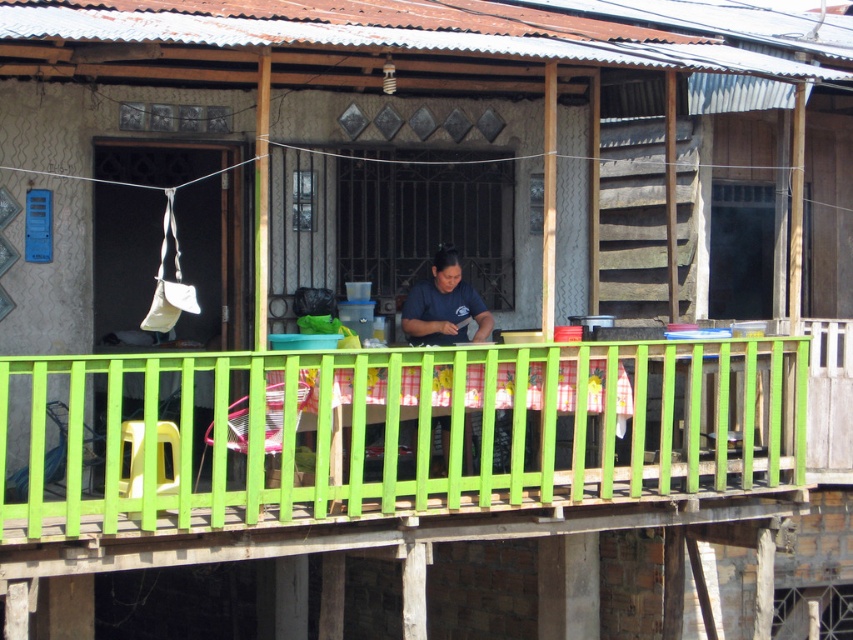
Question: Which point is farther to the camera?

Choices:
 (A) (370, 417)
 (B) (447, 461)

Answer: (B)

Question: Which point is farther to the camera?

Choices:
 (A) green plastic balustrade at center
 (B) dark blue shirt at center

Answer: (B)

Question: Can you confirm if green plastic balustrade at center is bigger than dark blue shirt at center?

Choices:
 (A) yes
 (B) no

Answer: (A)

Question: Is green plastic balustrade at center closer to camera compared to dark blue shirt at center?

Choices:
 (A) no
 (B) yes

Answer: (B)

Question: Can you confirm if green plastic balustrade at center is thinner than dark blue shirt at center?

Choices:
 (A) yes
 (B) no

Answer: (B)